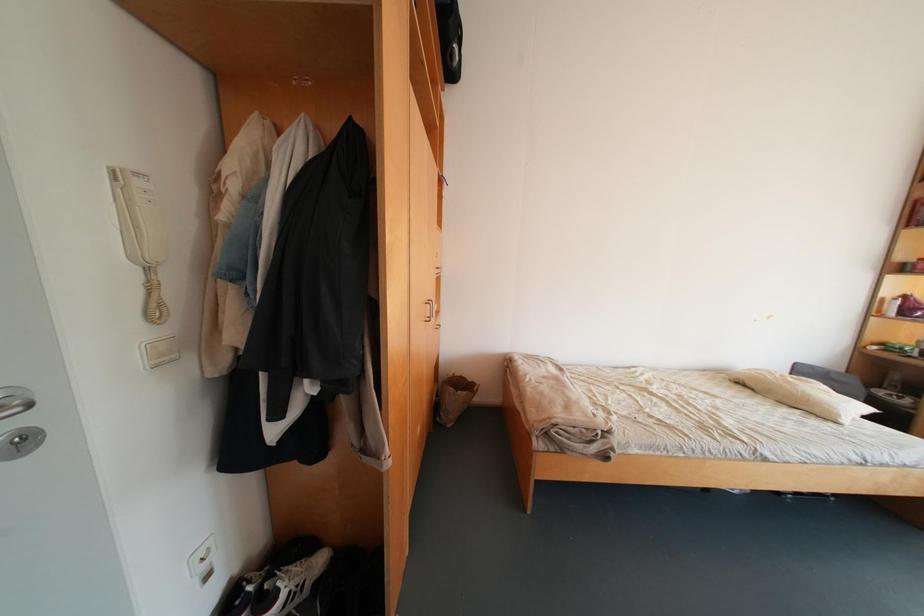
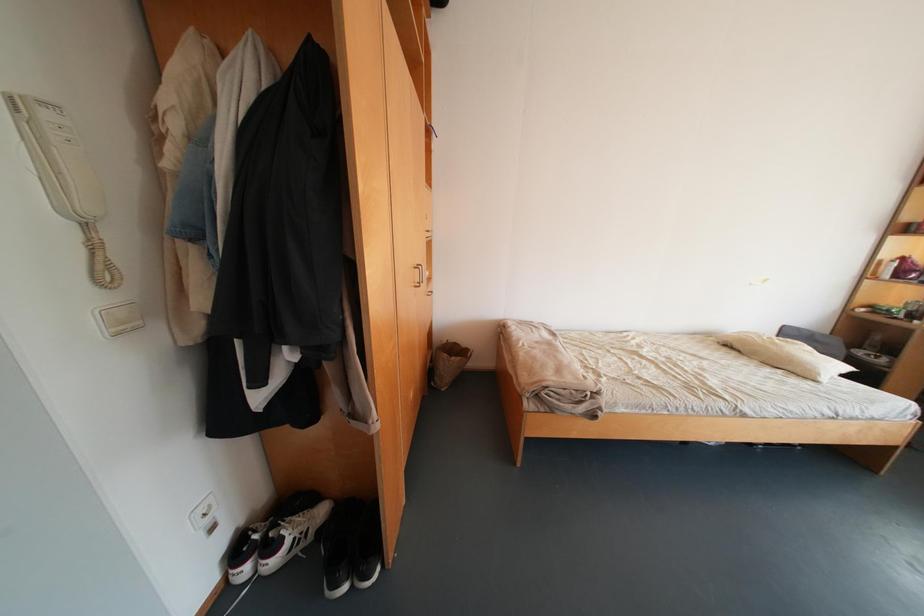
In a continuous first-person perspective shot, in which direction is the camera moving?

The cameraman walked toward right, forward.